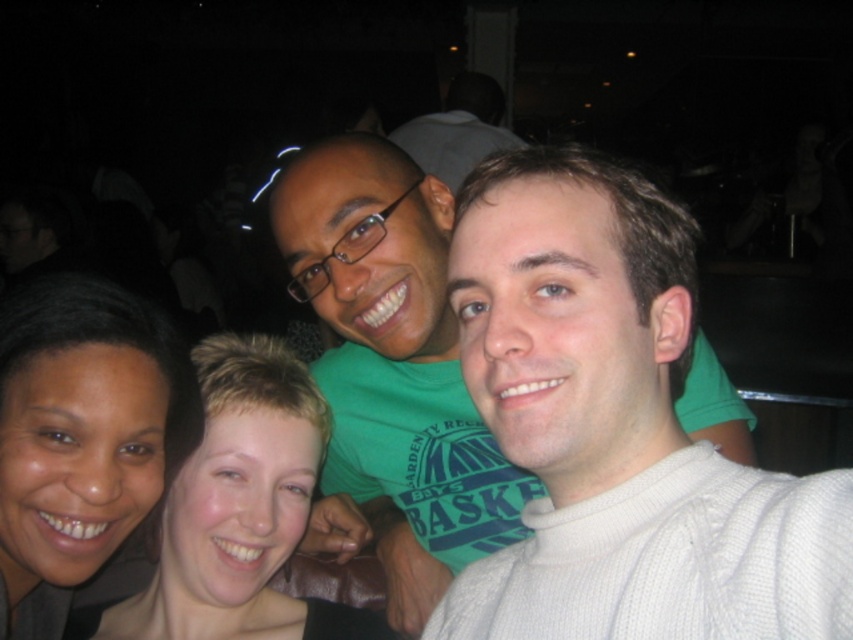
You are trying to identify who is in the photo. The dark skin tone at lower left and smooth skin face at center are two people in the image. Based on their positions, which one is physically closer to you?

The dark skin tone at lower left is positioned over smooth skin face at center, meaning the dark skin tone at lower left is closer to you.

You are trying to identify the location of the green matte shirt at center in this group photo. According to the coordinates provided, where exactly is it positioned?

The green matte shirt at center is positioned at coordinates point (x=395, y=365).